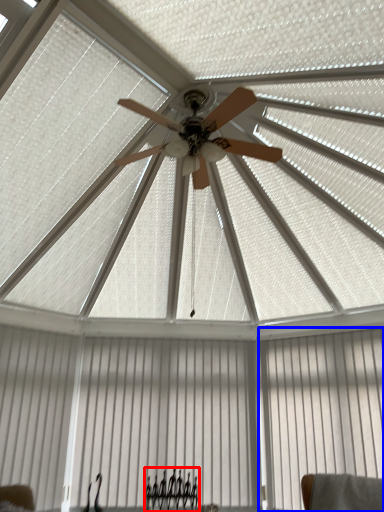
Question: Among these objects, which one is farthest to the camera, furniture (highlighted by a red box) or curtain (highlighted by a blue box)?

Choices:
 (A) furniture
 (B) curtain

Answer: (A)